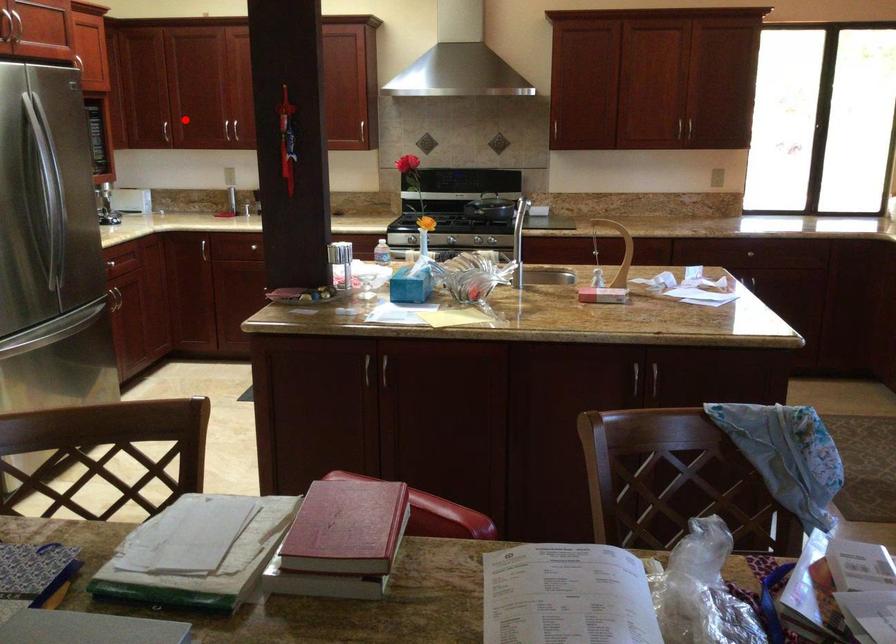
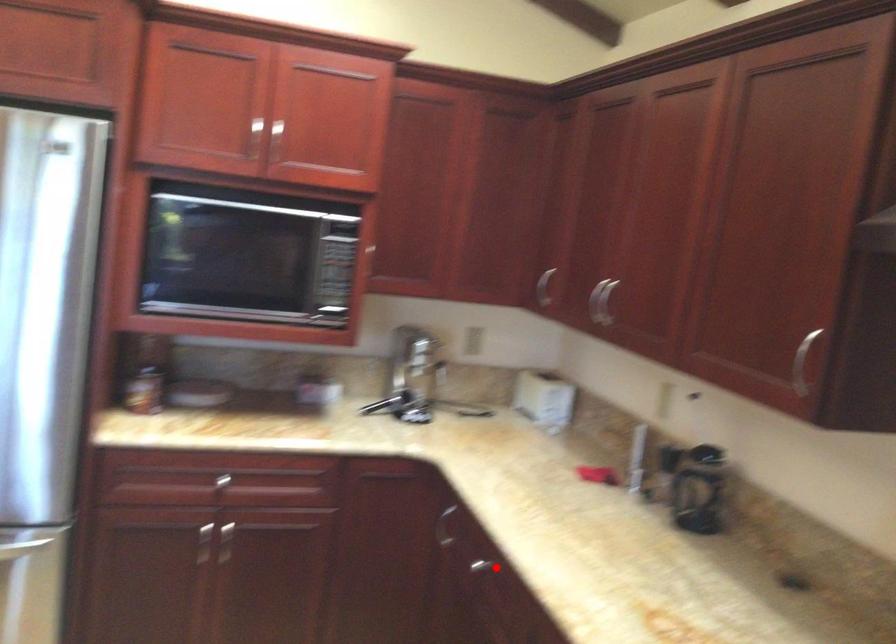
I am providing you with two images of the same scene from different viewpoints. A red point is marked on the first image and another point is marked on the second image. Is the red point in image1 aligned with the point shown in image2?

No